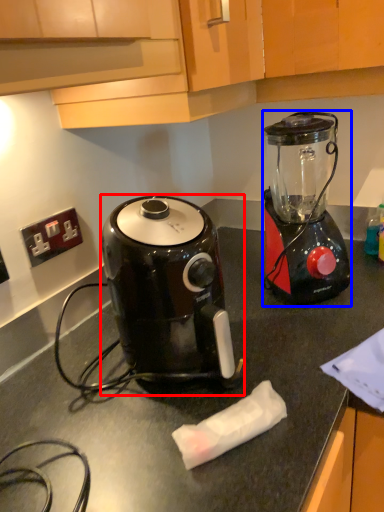
Question: Which point is closer to the camera, coffee maker (highlighted by a red box) or blender (highlighted by a blue box)?

Choices:
 (A) coffee maker
 (B) blender

Answer: (A)